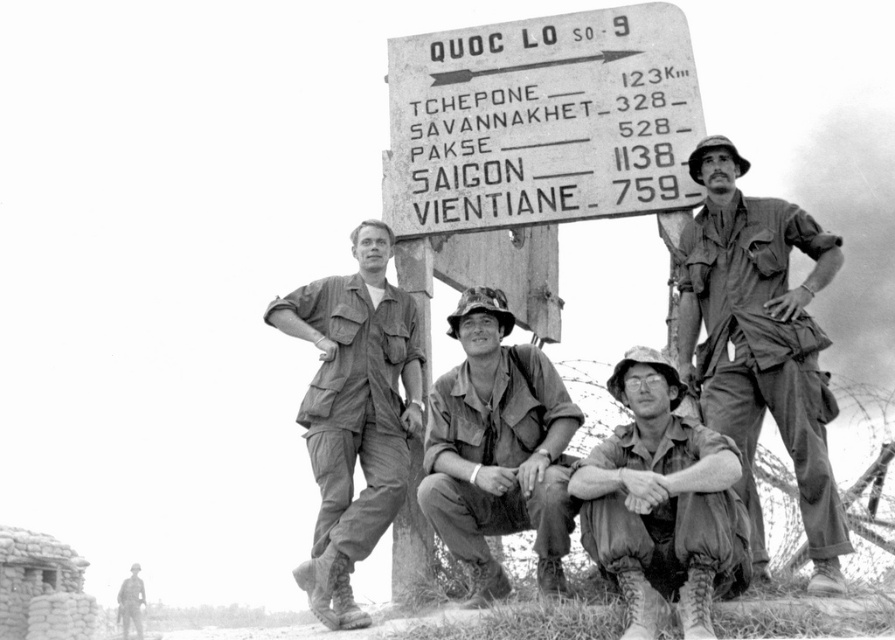
Question: Estimate the real-world distances between objects in this image. Which object is farther from the stone signpost at center?

Choices:
 (A) camouflage fabric uniform at center
 (B) matte khaki uniform at right

Answer: (A)

Question: Can you confirm if camouflage fabric pants at lower center is wider than camouflage uniform at lower left?

Choices:
 (A) no
 (B) yes

Answer: (B)

Question: Based on their relative distances, which object is farther from the matte khaki uniform at right?

Choices:
 (A) stone signpost at center
 (B) camouflage fabric pants at lower center

Answer: (A)

Question: Does stone signpost at center have a lesser width compared to camouflage fabric uniform at center?

Choices:
 (A) yes
 (B) no

Answer: (B)

Question: Which point is farther to the camera?

Choices:
 (A) camouflage fabric uniform at center
 (B) matte khaki uniform at right
 (C) matte khaki uniform at center

Answer: (C)

Question: Does matte khaki uniform at right appear on the left side of matte khaki uniform at center?

Choices:
 (A) yes
 (B) no

Answer: (B)